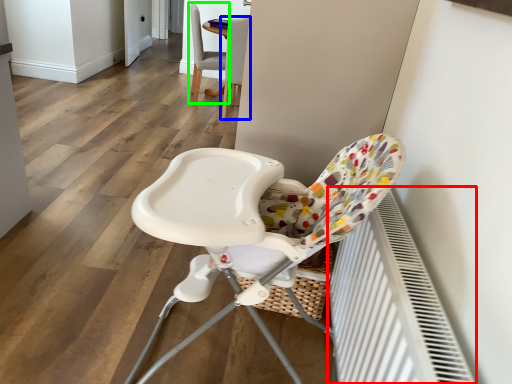
Question: Estimate the real-world distances between objects in this image. Which object is farther from radiator (highlighted by a red box), chair (highlighted by a blue box) or chair (highlighted by a green box)?

Choices:
 (A) chair
 (B) chair

Answer: (B)